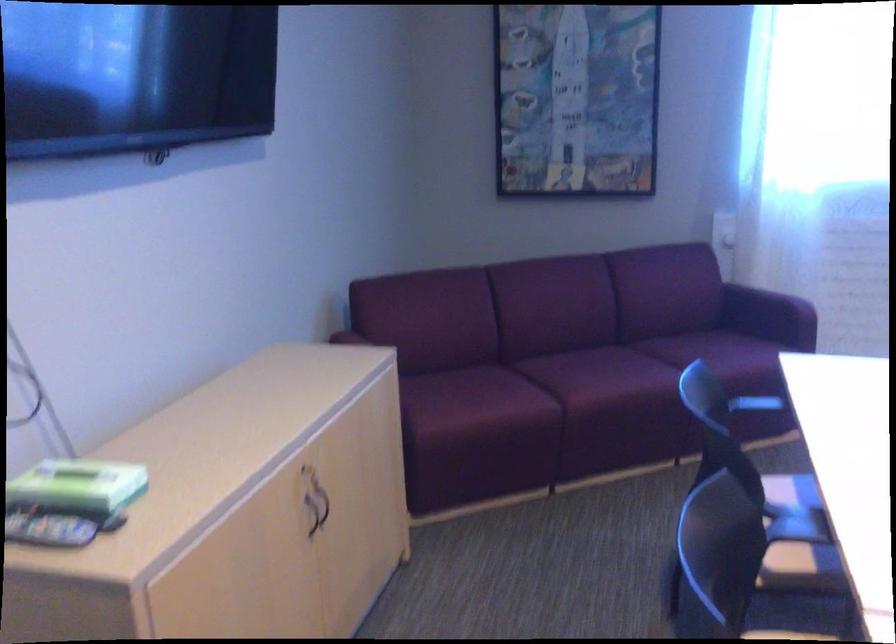
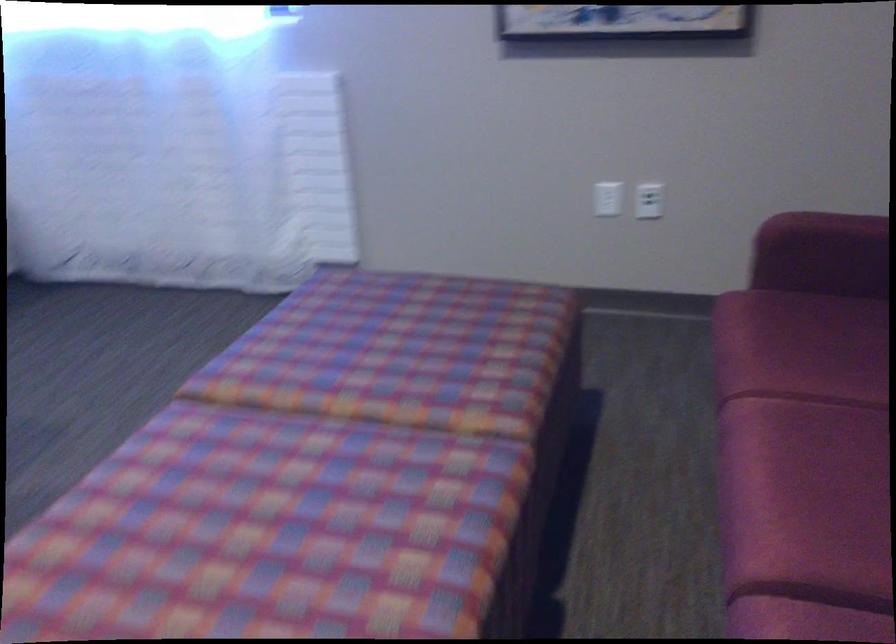
Question: Which direction would the cameraman need to move to produce the second image? Reply with the corresponding letter.

Choices:
 (A) Left
 (B) Right
 (C) Forward
 (D) Backward

Answer: (B)